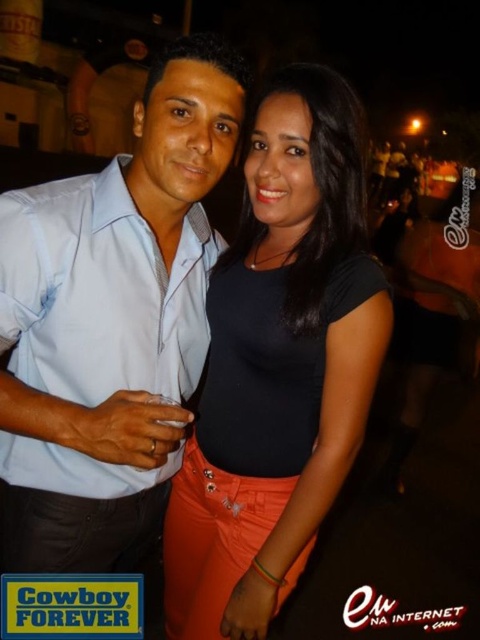
Question: Which point is farther from the camera taking this photo?

Choices:
 (A) (247, 408)
 (B) (9, 424)

Answer: (A)

Question: Does light blue shirt at center have a lesser width compared to black matte shirt at center?

Choices:
 (A) yes
 (B) no

Answer: (B)

Question: Is the position of light blue shirt at center more distant than that of black matte shirt at center?

Choices:
 (A) no
 (B) yes

Answer: (A)

Question: Is light blue shirt at center below black matte shirt at center?

Choices:
 (A) no
 (B) yes

Answer: (A)

Question: Which of the following is the farthest from the observer?

Choices:
 (A) (200, 451)
 (B) (26, 365)

Answer: (A)